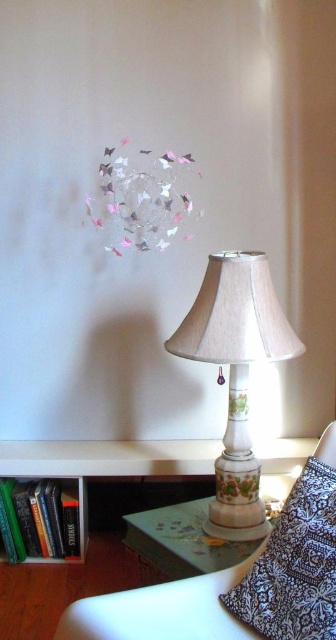
Is point (247, 291) positioned before point (276, 518)?

That is False.

What are the coordinates of `porcelain floral-patterned lampshade at center` in the screenshot? It's located at [235, 374].

Which is above, patterned fabric pillow at lower right or hardcover books at lower left?

patterned fabric pillow at lower right is higher up.

Can you confirm if patterned fabric pillow at lower right is bigger than hardcover books at lower left?

Yes, patterned fabric pillow at lower right is bigger than hardcover books at lower left.

Describe the element at coordinates (296, 560) in the screenshot. I see `patterned fabric pillow at lower right` at that location.

Where is `patterned fabric pillow at lower right`? patterned fabric pillow at lower right is located at coordinates (296, 560).

Does porcelain floral-patterned lampshade at center appear under hardcover books at lower left?

No.

Between point (218, 490) and point (6, 541), which one is positioned in front?

Point (218, 490) is in front.

This screenshot has width=336, height=640. What are the coordinates of `porcelain floral-patterned lampshade at center` in the screenshot? It's located at (235, 374).